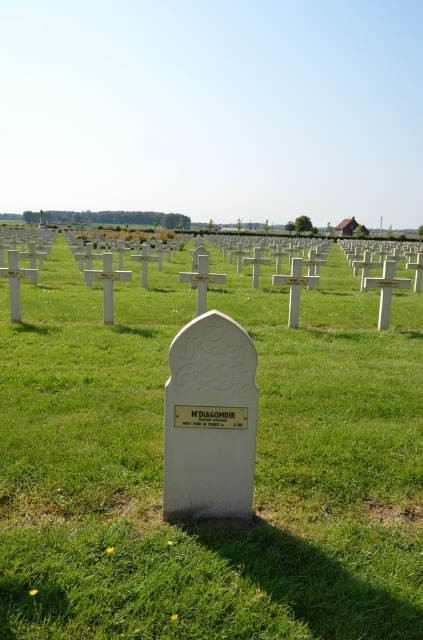
Is point (77, 333) positioned in front of point (172, 445)?

No, (77, 333) is behind (172, 445).

Does white stone cross at center have a smaller size compared to white stone gravestone at center?

Actually, white stone cross at center might be larger than white stone gravestone at center.

The height and width of the screenshot is (640, 423). In order to click on white stone cross at center in this screenshot , I will do [255, 468].